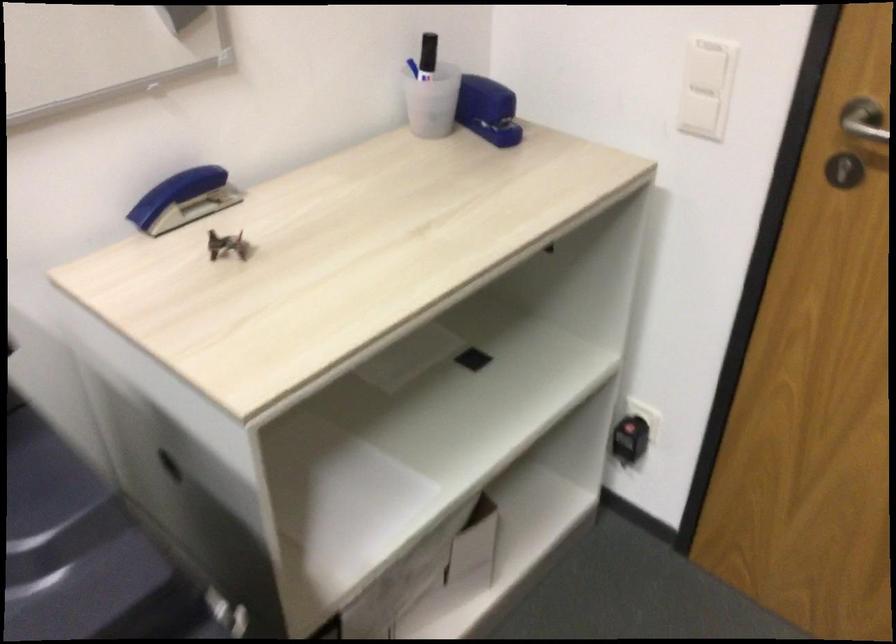
This screenshot has width=896, height=644. I want to click on black power adapter, so click(x=630, y=439).